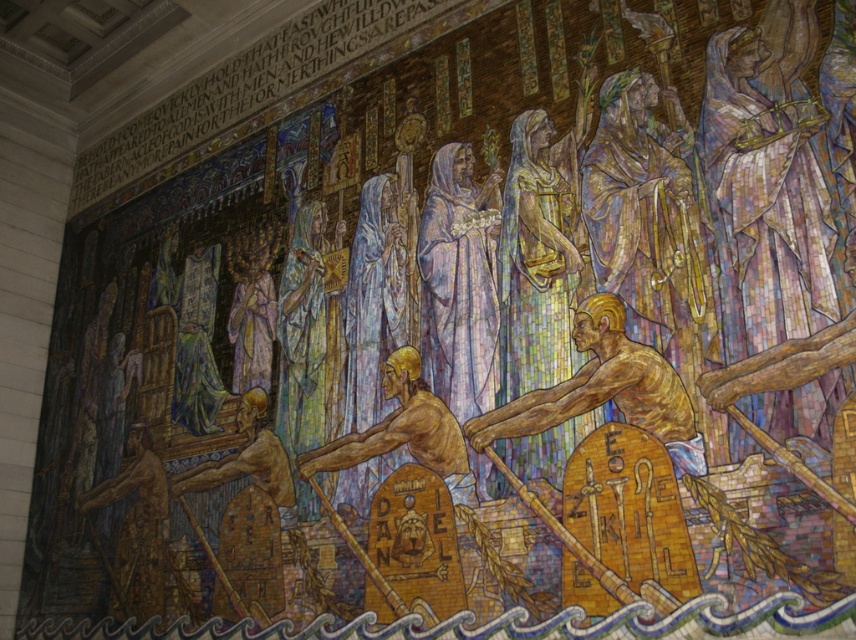
Does point (480, 221) come farther from viewer compared to point (241, 406)?

No, it is not.

Where is `pastel silk robe at center`? pastel silk robe at center is located at coordinates (459, 282).

Image resolution: width=856 pixels, height=640 pixels. What are the coordinates of `pastel silk robe at center` in the screenshot? It's located at (459, 282).

Does golden textured figure at center have a lesser width compared to brown textured figure at center?

Correct, golden textured figure at center's width is less than brown textured figure at center's.

What do you see at coordinates (605, 390) in the screenshot? The width and height of the screenshot is (856, 640). I see `golden textured figure at center` at bounding box center [605, 390].

This screenshot has width=856, height=640. Describe the element at coordinates (605, 390) in the screenshot. I see `golden textured figure at center` at that location.

Find the location of `golden textured figure at center`. golden textured figure at center is located at coordinates (605, 390).

Does pastel silk robe at center have a lesser width compared to brown textured figure at center?

Yes, pastel silk robe at center is thinner than brown textured figure at center.

Does point (455, 157) come in front of point (348, 460)?

No.

Is point (491, 214) behind point (383, 371)?

No, it is in front of (383, 371).

Find the location of a particular element. This screenshot has height=640, width=856. pastel silk robe at center is located at coordinates (459, 282).